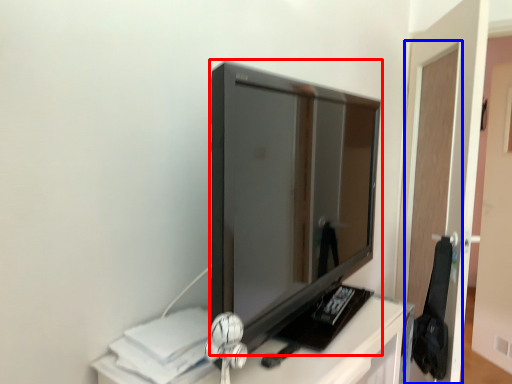
Question: Which object appears farthest to the camera in this image, television (highlighted by a red box) or glass door (highlighted by a blue box)?

Choices:
 (A) television
 (B) glass door

Answer: (B)